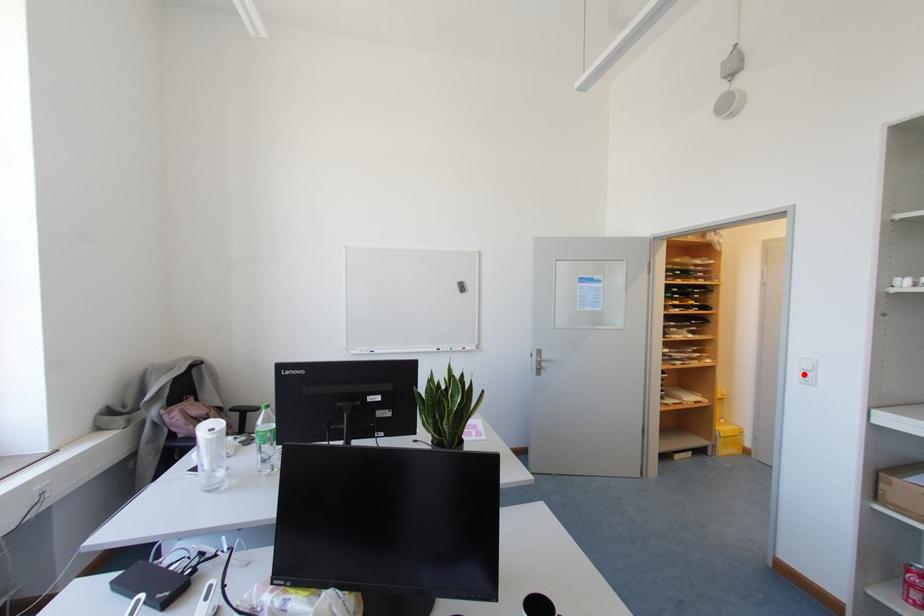
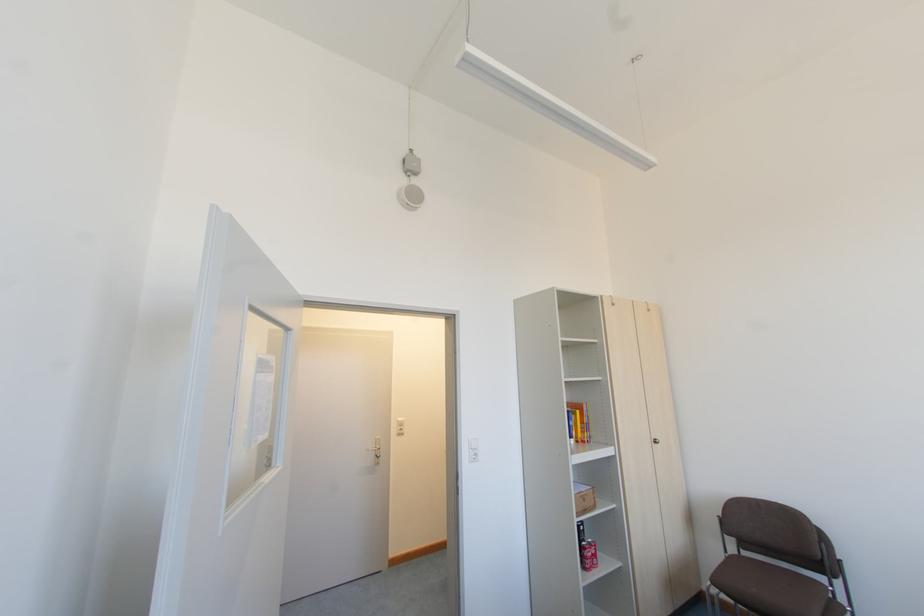
Locate, in the second image, the point that corresponds to the highlighted location in the first image.

(472, 453)